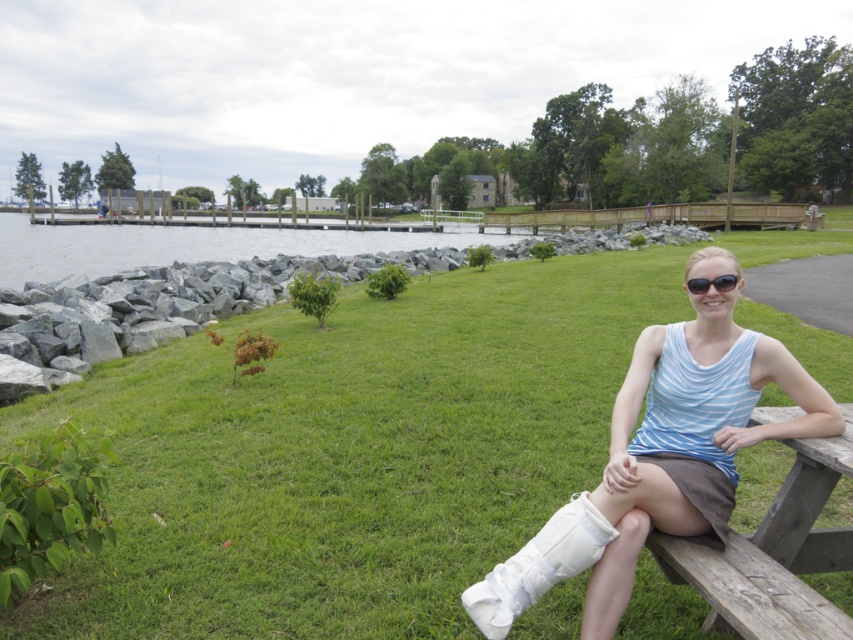
Question: Is white matte cast at center above black plastic sunglasses at upper center?

Choices:
 (A) no
 (B) yes

Answer: (A)

Question: Which is nearer to the black plastic sunglasses at upper center?

Choices:
 (A) green grass at center
 (B) white matte cast at center
 (C) wooden park bench at lower right

Answer: (B)

Question: Does green grass at center appear on the right side of wooden park bench at lower right?

Choices:
 (A) no
 (B) yes

Answer: (B)

Question: Observing the image, what is the correct spatial positioning of green grass at center in reference to black plastic sunglasses at upper center?

Choices:
 (A) left
 (B) right

Answer: (B)

Question: Which point is farther to the camera?

Choices:
 (A) (654, 488)
 (B) (9, 218)

Answer: (B)

Question: Which point appears farthest from the camera in this image?

Choices:
 (A) (704, 291)
 (B) (537, 365)
 (C) (572, 573)
 (D) (173, 243)

Answer: (D)